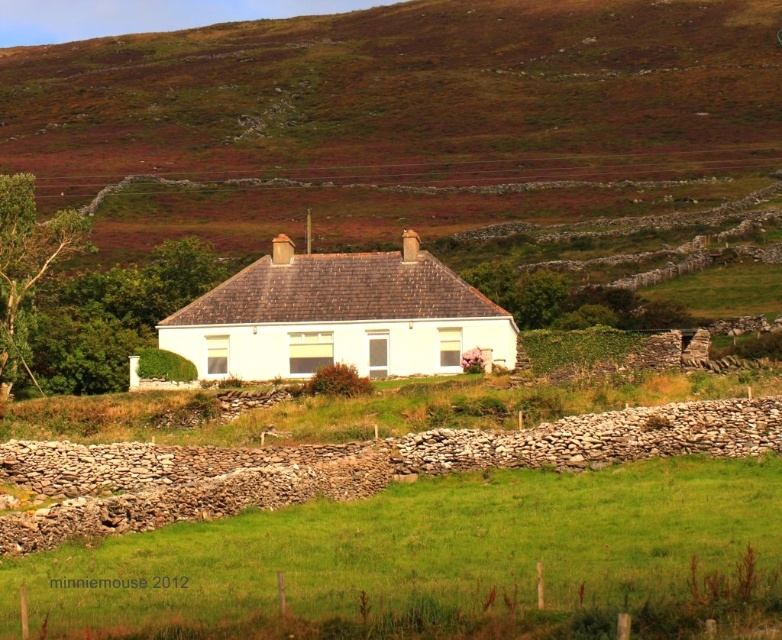
Who is more forward, (153, 586) or (433, 317)?

Point (153, 586) is in front.

Does green grass at center have a larger size compared to white smooth house at center?

Indeed, green grass at center has a larger size compared to white smooth house at center.

Where is `green grass at center`? green grass at center is located at coordinates (422, 548).

Does green grass at center appear on the right side of green grassy at center?

Yes, green grass at center is to the right of green grassy at center.

Does green grass at center have a smaller size compared to green grassy at center?

Yes, green grass at center is smaller than green grassy at center.

Where is `green grass at center`? This screenshot has height=640, width=782. green grass at center is located at coordinates (422, 548).

Which is in front, point (323, 269) or point (386, 433)?

Positioned in front is point (386, 433).

You are a GUI agent. You are given a task and a screenshot of the screen. Output one action in this format:
    pyautogui.click(x=<x>, y=<y>)
    Task: Click on the white smooth house at center
    
    Given the screenshot: What is the action you would take?
    pyautogui.click(x=339, y=317)

This screenshot has height=640, width=782. What do you see at coordinates (339, 317) in the screenshot?
I see `white smooth house at center` at bounding box center [339, 317].

Where is `white smooth house at center`? white smooth house at center is located at coordinates (339, 317).